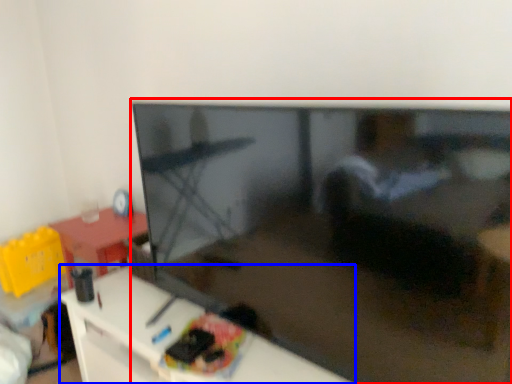
Question: Which of the following is the farthest to the observer, television (highlighted by a red box) or furniture (highlighted by a blue box)?

Choices:
 (A) television
 (B) furniture

Answer: (B)